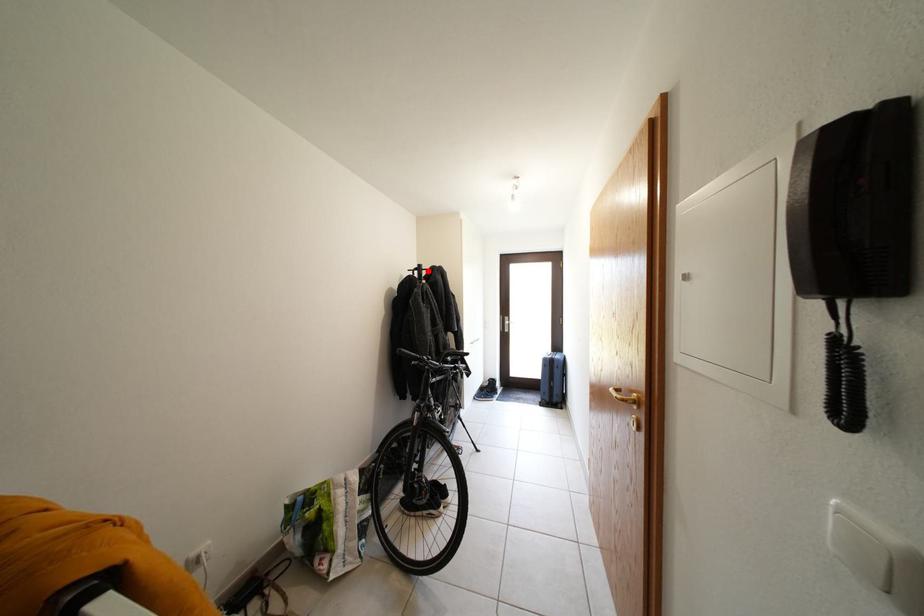
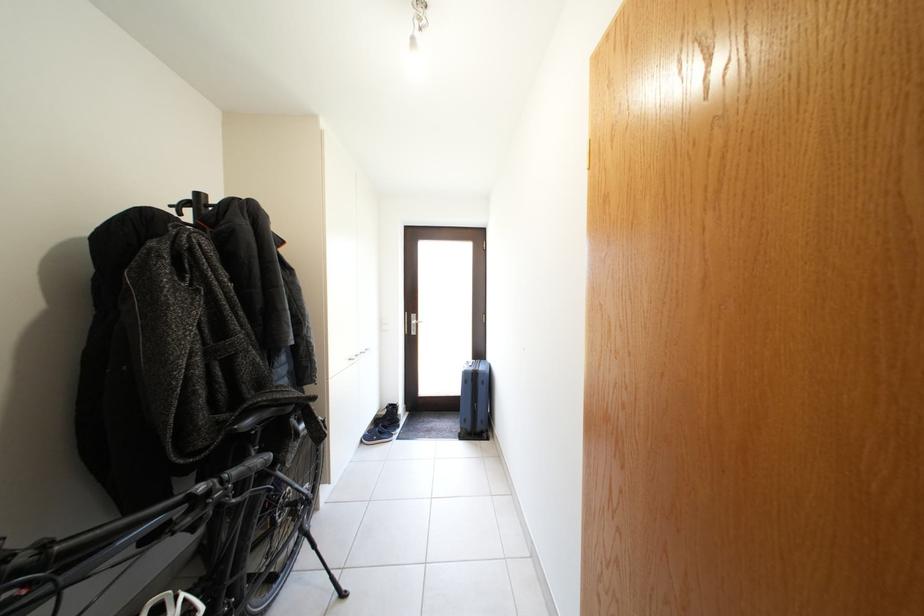
The point at the highlighted location is marked in the first image. Where is the corresponding point in the second image?

(205, 200)